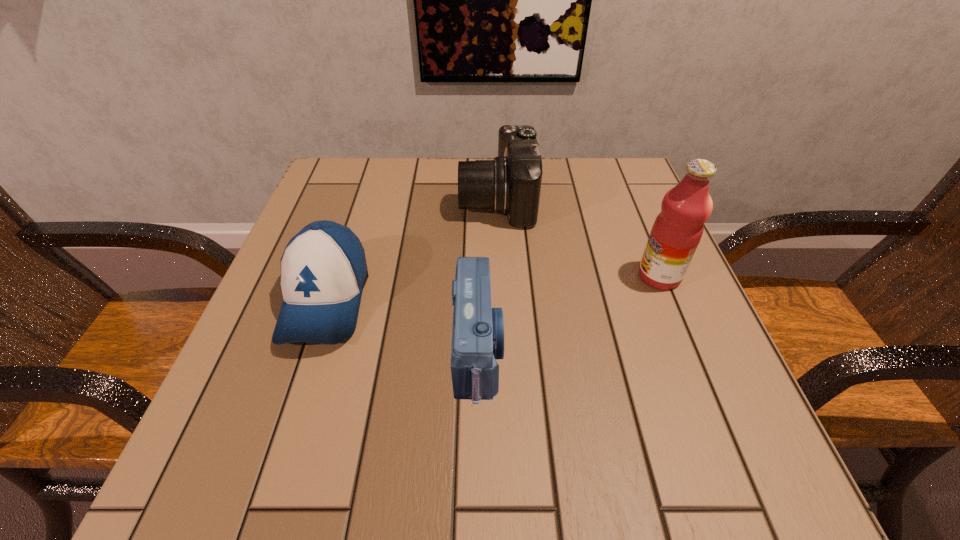
The height and width of the screenshot is (540, 960). Find the location of `the tallest object`. the tallest object is located at coordinates (677, 230).

Image resolution: width=960 pixels, height=540 pixels. What are the coordinates of `the rightmost object` in the screenshot? It's located at (677, 230).

This screenshot has width=960, height=540. In order to click on the farthest object in this screenshot , I will do `click(510, 184)`.

Locate an element on the screen. The height and width of the screenshot is (540, 960). the farther camera is located at coordinates (510, 184).

I want to click on the leftmost object, so click(323, 268).

Locate an element on the screen. This screenshot has height=540, width=960. the nearer camera is located at coordinates (478, 329).

At what (x,y) coordinates should I click in order to perform the action: click on blank area located 0.150m on the label of the fruit juice. Please return your answer as a coordinate pair (x, y). This screenshot has width=960, height=540. Looking at the image, I should click on (560, 276).

Locate an element on the screen. blank space located 0.150m on the label of the fruit juice is located at coordinates (560, 276).

Find the location of a particular element. This screenshot has width=960, height=540. vacant space located 0.220m on the label of the fruit juice is located at coordinates (523, 276).

The width and height of the screenshot is (960, 540). I want to click on free space located on the lens of the farthest object, so click(417, 200).